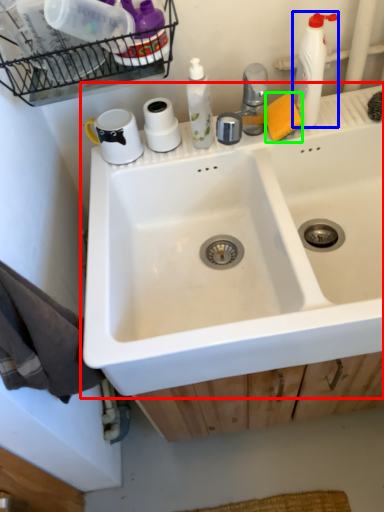
Question: Which object is positioned farthest from sink (highlighted by a red box)? Select from cleaning product (highlighted by a blue box) and soap (highlighted by a green box).

Choices:
 (A) cleaning product
 (B) soap

Answer: (A)